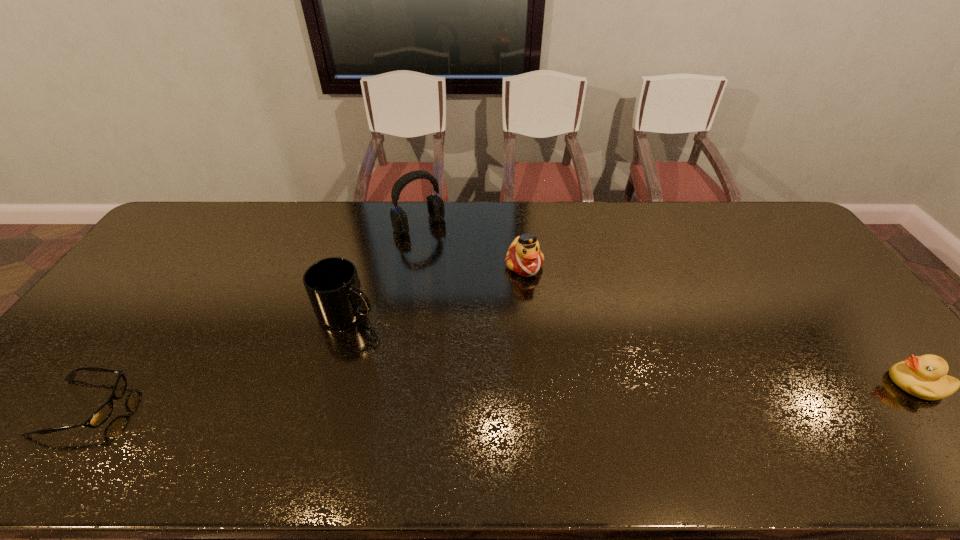
At what (x,y) coordinates should I click in order to perform the action: click on spectacles. Please return your answer as a coordinate pair (x, y). Image resolution: width=960 pixels, height=540 pixels. Looking at the image, I should click on (101, 415).

The image size is (960, 540). I want to click on the leftmost object, so tap(101, 415).

The width and height of the screenshot is (960, 540). Find the location of `duckling`. duckling is located at coordinates (924, 376).

Locate an element on the screen. This screenshot has height=540, width=960. the rightmost object is located at coordinates (924, 376).

Identify the location of the second farthest object. Image resolution: width=960 pixels, height=540 pixels. (524, 257).

What are the coordinates of `duck` in the screenshot? It's located at (524, 257).

Where is `the third nearest object`? The width and height of the screenshot is (960, 540). the third nearest object is located at coordinates (334, 289).

Identify the location of the tallest object. (435, 205).

Where is `headset`? headset is located at coordinates (435, 205).

You are a GUI agent. You are given a task and a screenshot of the screen. Output one action in this format:
    pyautogui.click(x=<x>, y=<y>)
    Task: Click on the vacant space located on the front-facing side of the leftmost object
    
    Given the screenshot: What is the action you would take?
    pyautogui.click(x=239, y=408)